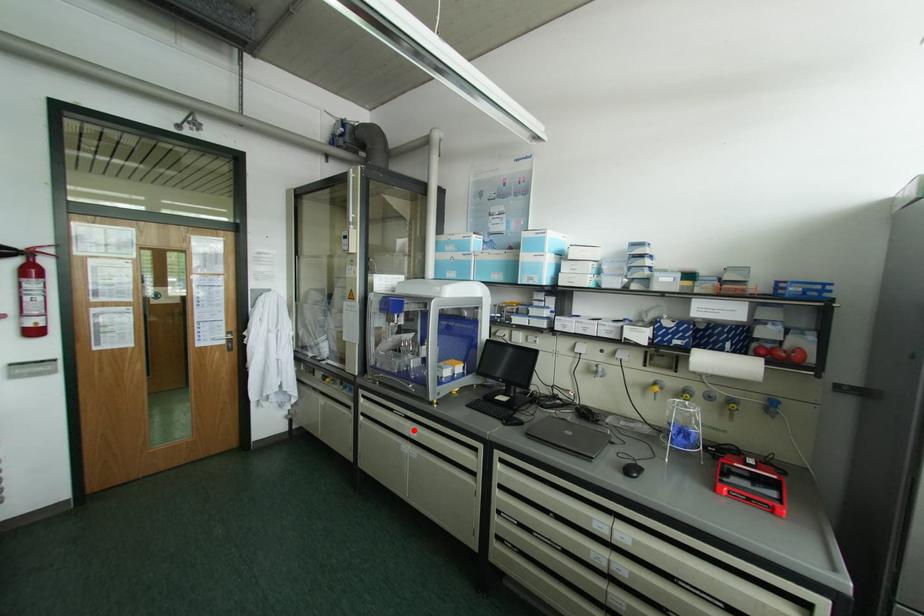
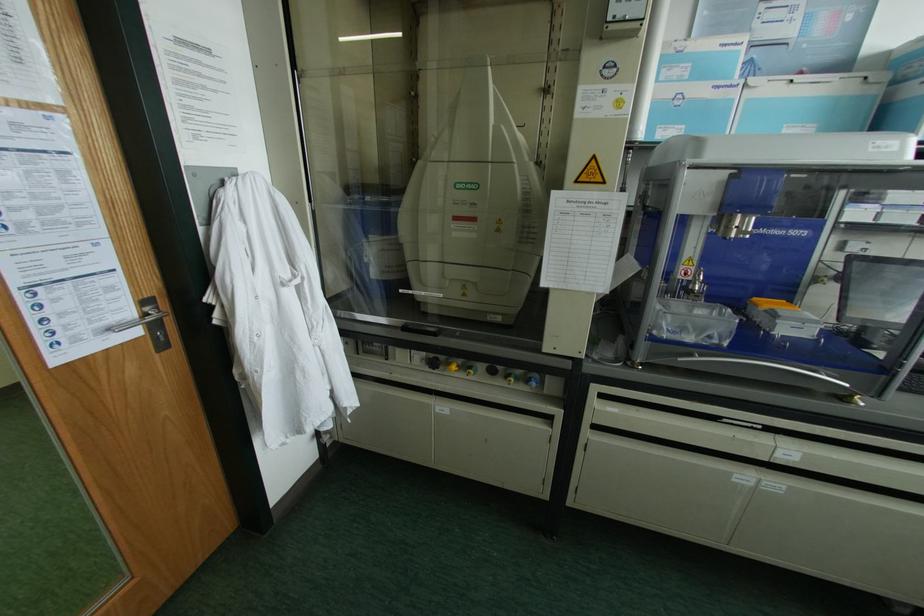
Find the pixel in the second image that matches the highlighted location in the first image.

(789, 451)